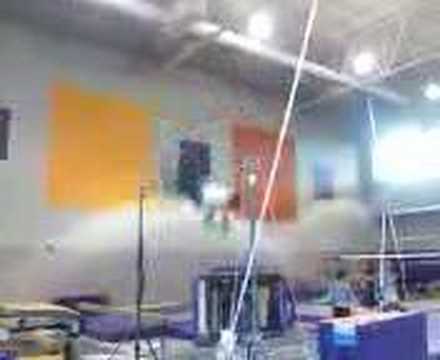
I want to click on flooring, so [x=196, y=357].